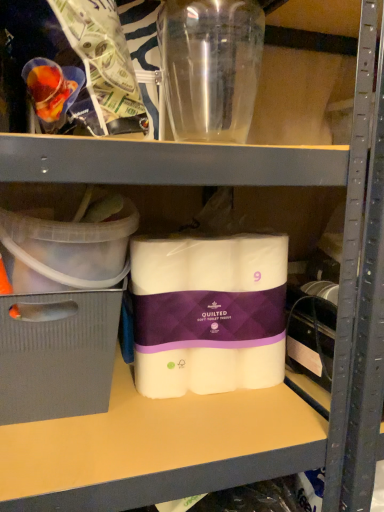
Question: Can you confirm if clear plastic container at left, the 2th storage box positioned from the bottom, is positioned to the right of transparent plastic bottle at upper center?

Choices:
 (A) no
 (B) yes

Answer: (A)

Question: Considering the relative sizes of clear plastic container at left, the 2th storage box positioned from the bottom, and transparent plastic bottle at upper center in the image provided, is clear plastic container at left, the 2th storage box positioned from the bottom, thinner than transparent plastic bottle at upper center?

Choices:
 (A) no
 (B) yes

Answer: (A)

Question: From a real-world perspective, is clear plastic container at left, acting as the first storage box starting from the top, physically above transparent plastic bottle at upper center?

Choices:
 (A) yes
 (B) no

Answer: (B)

Question: Is clear plastic container at left, the 2th storage box positioned from the bottom, next to transparent plastic bottle at upper center?

Choices:
 (A) yes
 (B) no

Answer: (B)

Question: Is transparent plastic bottle at upper center located within clear plastic container at left, acting as the first storage box starting from the top?

Choices:
 (A) yes
 (B) no

Answer: (B)

Question: Is clear plastic container at left, the 2th storage box positioned from the bottom, far away from transparent plastic bottle at upper center?

Choices:
 (A) no
 (B) yes

Answer: (A)

Question: Considering the relative sizes of transparent plastic bottle at upper center and gray cardboard box at left, which is counted as the 1th storage box, starting from the bottom, in the image provided, is transparent plastic bottle at upper center wider than gray cardboard box at left, which is counted as the 1th storage box, starting from the bottom,?

Choices:
 (A) yes
 (B) no

Answer: (B)

Question: Is transparent plastic bottle at upper center oriented towards gray cardboard box at left, which is counted as the 1th storage box, starting from the bottom?

Choices:
 (A) no
 (B) yes

Answer: (A)

Question: Is gray cardboard box at left, which is counted as the 1th storage box, starting from the bottom, surrounded by transparent plastic bottle at upper center?

Choices:
 (A) no
 (B) yes

Answer: (A)

Question: From a real-world perspective, is transparent plastic bottle at upper center physically below gray cardboard box at left, the 2th storage box viewed from the top?

Choices:
 (A) no
 (B) yes

Answer: (A)

Question: Is transparent plastic bottle at upper center facing away from gray cardboard box at left, the 2th storage box viewed from the top?

Choices:
 (A) yes
 (B) no

Answer: (B)

Question: Does transparent plastic bottle at upper center appear on the right side of gray cardboard box at left, the 2th storage box viewed from the top?

Choices:
 (A) no
 (B) yes

Answer: (B)

Question: Is the position of clear plastic container at left, acting as the first storage box starting from the top, less distant than that of gray cardboard box at left, the 2th storage box viewed from the top?

Choices:
 (A) yes
 (B) no

Answer: (A)